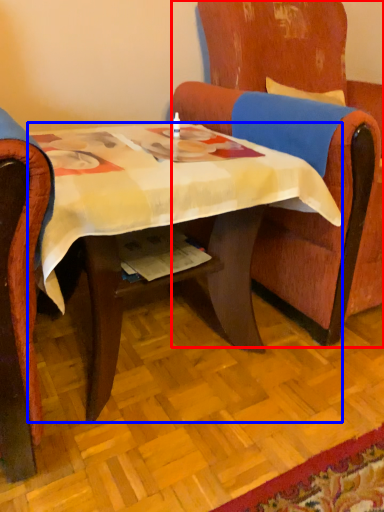
Question: Among these objects, which one is nearest to the camera, chair (highlighted by a red box) or desk (highlighted by a blue box)?

Choices:
 (A) chair
 (B) desk

Answer: (B)